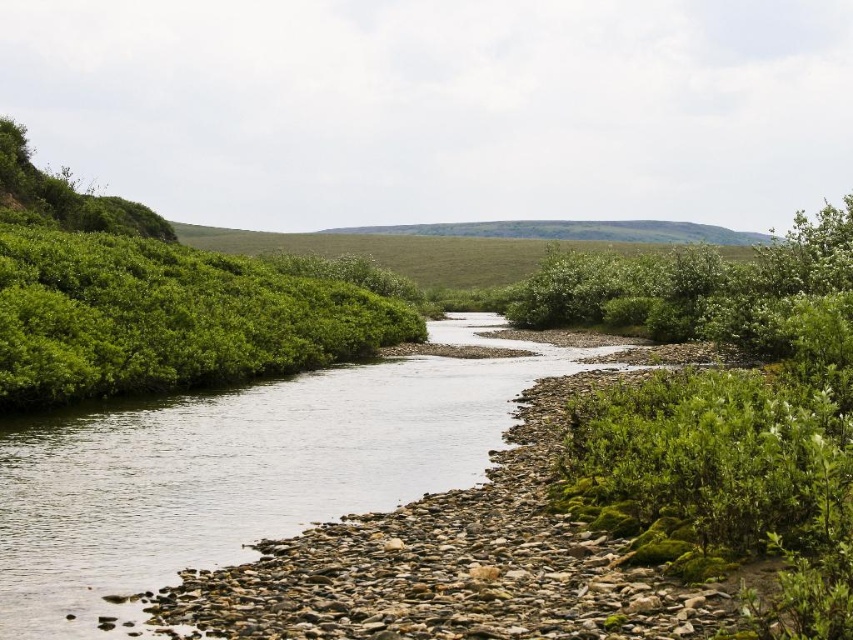
Which of these two, clear water at center or green leafy shrubs at left, stands taller?

green leafy shrubs at left

Can you confirm if clear water at center is shorter than green leafy shrubs at left?

Indeed, clear water at center has a lesser height compared to green leafy shrubs at left.

Is point (312, 424) in front of point (276, 323)?

Yes, point (312, 424) is in front of point (276, 323).

The image size is (853, 640). I want to click on clear water at center, so click(x=239, y=472).